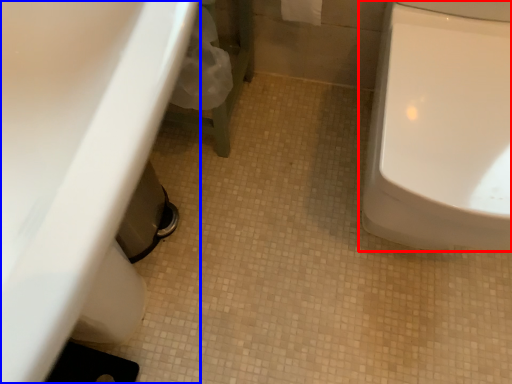
Question: Which of the following is the closest to the observer, toilet (highlighted by a red box) or sink (highlighted by a blue box)?

Choices:
 (A) toilet
 (B) sink

Answer: (B)